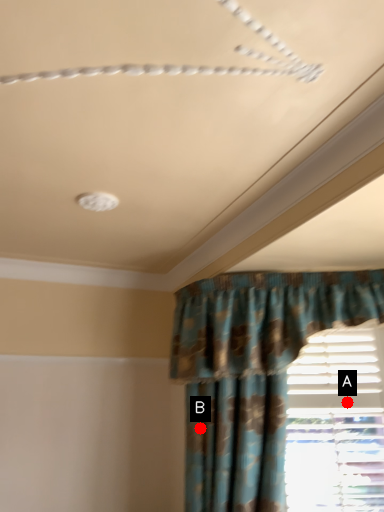
Question: Two points are circled on the image, labeled by A and B beside each circle. Which point is closer to the camera taking this photo?

Choices:
 (A) A is closer
 (B) B is closer

Answer: (B)